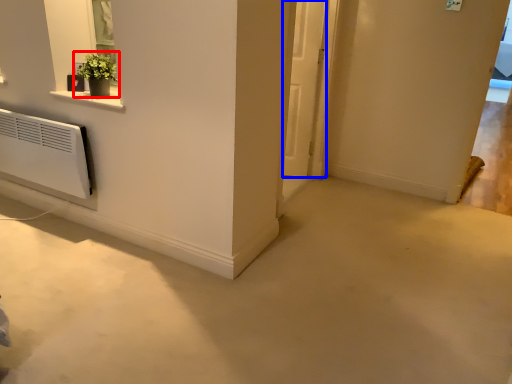
Question: Which of the following is the closest to the observer, houseplant (highlighted by a red box) or door (highlighted by a blue box)?

Choices:
 (A) houseplant
 (B) door

Answer: (A)